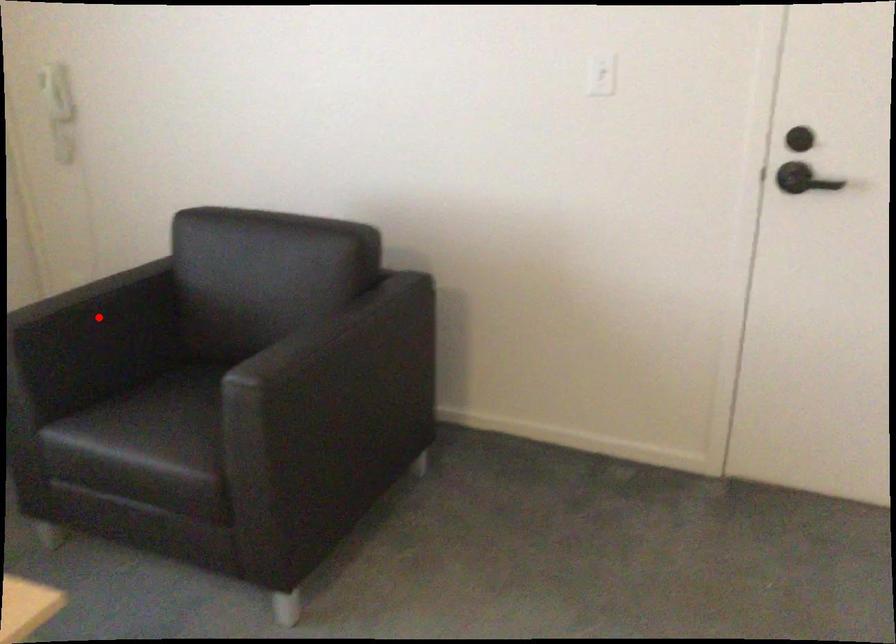
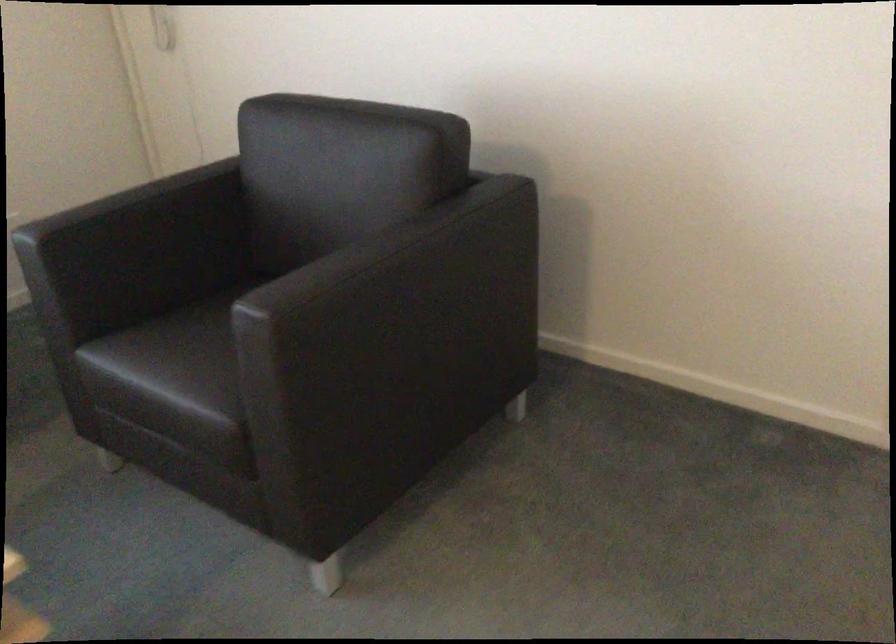
Question: I am providing you with two images of the same scene from different viewpoints. A red point is shown in image1. For the corresponding object point in image2, is it positioned nearer or farther from the camera?

Choices:
 (A) Nearer
 (B) Farther

Answer: (A)